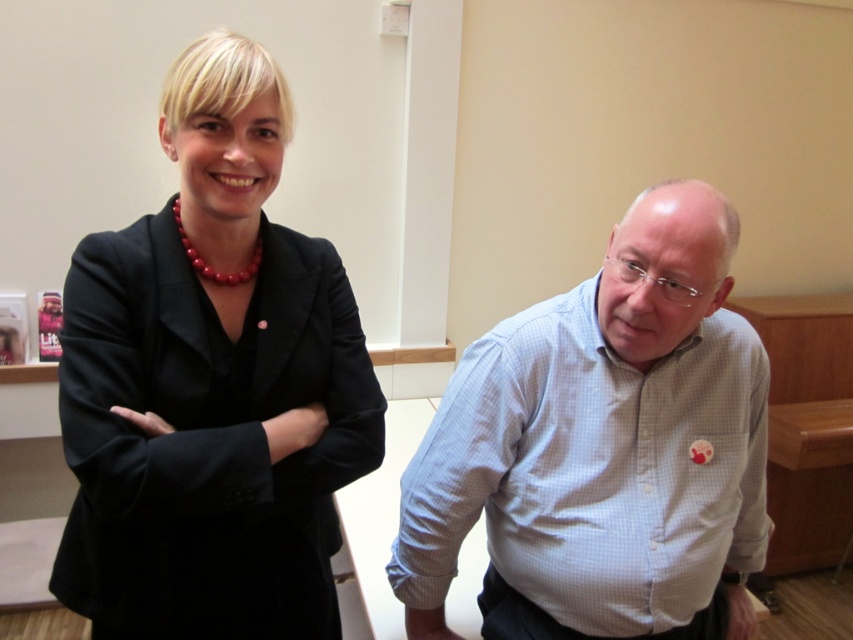
You are an interior designer working on a layout for this space. The black matte blazer at upper left is positioned at coordinates point 0.603, 0.249. If you need to place a decorative item exactly 0.3 units to the right of this point, what coordinate would that be?

The coordinate would be 0.603 plus 0.3 equals 0.906 in the x direction. So the new coordinate is (x=212, y=579).

You are organizing a photo shoot and need to arrange two outfits for a catalog. The black matte blazer at upper left and the white checkered shirt at right are both part of the collection. Based on their positions in the image, which outfit should be placed on the left side of the display to maintain the same spatial arrangement as shown?

The black matte blazer at upper left should be placed on the left side of the display because in the image, it is already positioned to the left of the white checkered shirt at right.